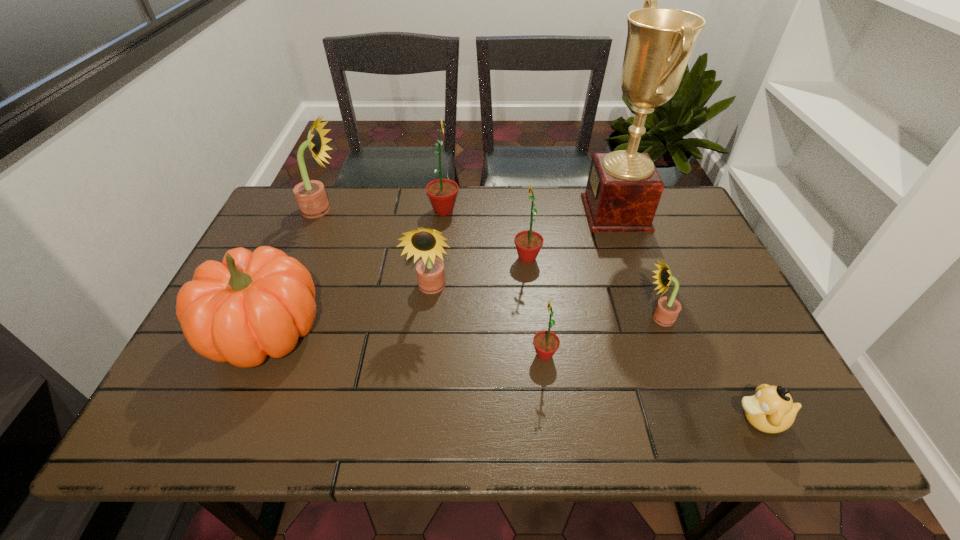
At what (x,y) coordinates should I click in order to perform the action: click on duckling located in the right edge section of the desktop. Please return your answer as a coordinate pair (x, y). Looking at the image, I should click on (771, 410).

Identify the location of object that is positioned at the far left corner. (310, 195).

Locate an element on the screen. The image size is (960, 540). object that is at the far right corner is located at coordinates (623, 190).

At what (x,y) coordinates should I click in order to perform the action: click on object located in the near right corner section of the desktop. Please return your answer as a coordinate pair (x, y). The width and height of the screenshot is (960, 540). Looking at the image, I should click on (771, 410).

Identify the location of vacant space at the far edge of the desktop. coord(474,214).

The width and height of the screenshot is (960, 540). Identify the location of free space at the near edge of the desktop. (377, 434).

Where is `vacant space at the left edge of the desktop`? vacant space at the left edge of the desktop is located at coordinates (273, 247).

This screenshot has height=540, width=960. In the image, there is a desktop. Find the location of `free region at the right edge`. free region at the right edge is located at coordinates (702, 238).

In order to click on vacant space at the far left corner of the desktop in this screenshot , I will do `click(276, 204)`.

At what (x,y) coordinates should I click in order to perform the action: click on free space between the farthest green sunflower and the nearest yellow sunflower. Please return your answer as a coordinate pair (x, y). Looking at the image, I should click on (551, 264).